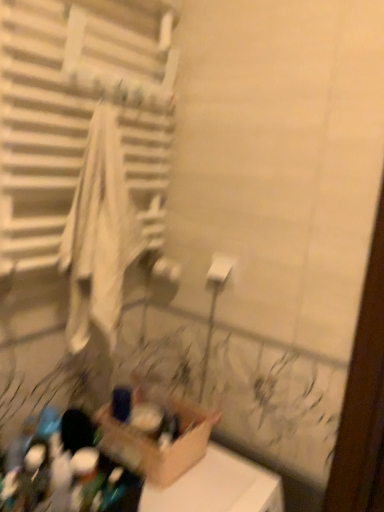
Describe the element at coordinates (154, 440) in the screenshot. I see `cardboard box at lower center` at that location.

What is the approximate width of white fabric towel at left?

white fabric towel at left is 6.79 inches wide.

This screenshot has height=512, width=384. Describe the element at coordinates (99, 236) in the screenshot. I see `white fabric towel at left` at that location.

What is the approximate width of white matte toilet paper at center?

1.85 inches.

Where is `cardboard box at lower center`? cardboard box at lower center is located at coordinates (154, 440).

Locate an element on the screen. bath towel above the cardboard box at lower center (from a real-world perspective) is located at coordinates (99, 236).

Which point is more distant from viewer, (x=185, y=449) or (x=85, y=297)?

The point (x=185, y=449) is more distant.

Is cardboard box at lower center positioned with its back to white fabric towel at left?

No, cardboard box at lower center's orientation is not away from white fabric towel at left.

Is cardboard box at lower center with white fabric towel at left?

No, cardboard box at lower center is not beside white fabric towel at left.

Find the location of `cardboard box located below the white matte toilet paper at center (from the image's perspective)`. cardboard box located below the white matte toilet paper at center (from the image's perspective) is located at coordinates (154, 440).

How far apart are white matte toilet paper at center and cardboard box at lower center?

A distance of 16.97 inches exists between white matte toilet paper at center and cardboard box at lower center.

In the image, is white matte toilet paper at center positioned in front of or behind cardboard box at lower center?

Clearly, white matte toilet paper at center is behind cardboard box at lower center.

From the picture: Considering the relative sizes of white matte toilet paper at center and cardboard box at lower center in the image provided, is white matte toilet paper at center taller than cardboard box at lower center?

No.

Is white matte toilet paper at center oriented towards white fabric towel at left?

Yes, white matte toilet paper at center is turned towards white fabric towel at left.

From the picture: Is white matte toilet paper at center bigger than white fabric towel at left?

Actually, white matte toilet paper at center might be smaller than white fabric towel at left.

Based on the photo, from the image's perspective, is white matte toilet paper at center on top of white fabric towel at left?

Actually, white matte toilet paper at center appears below white fabric towel at left in the image.

How distant is white matte toilet paper at center from white fabric towel at left?

white matte toilet paper at center is 34.87 centimeters from white fabric towel at left.

Considering the sizes of objects white fabric towel at left and white matte toilet paper at center in the image provided, who is smaller, white fabric towel at left or white matte toilet paper at center?

With smaller size is white matte toilet paper at center.

Considering the relative positions of white fabric towel at left and white matte toilet paper at center in the image provided, is white fabric towel at left in front of white matte toilet paper at center?

Yes, the depth of white fabric towel at left is less than that of white matte toilet paper at center.

The image size is (384, 512). Identify the location of bath towel above the white matte toilet paper at center (from the image's perspective). (99, 236).

Which is behind, white fabric towel at left or cardboard box at lower center?

cardboard box at lower center is further from the camera.

From a real-world perspective, is white fabric towel at left positioned above or below cardboard box at lower center?

Clearly, from a real-world perspective, white fabric towel at left is above cardboard box at lower center.

Is cardboard box at lower center completely or partially inside white fabric towel at left?

No.

Consider the image. From the image's perspective, is cardboard box at lower center below white matte toilet paper at center?

Indeed, from the image's perspective, cardboard box at lower center is shown beneath white matte toilet paper at center.

Is cardboard box at lower center touching white matte toilet paper at center?

No, cardboard box at lower center is not in contact with white matte toilet paper at center.

Considering the relative sizes of cardboard box at lower center and white matte toilet paper at center in the image provided, is cardboard box at lower center smaller than white matte toilet paper at center?

No.

Where is `bath towel that appears above the cardboard box at lower center (from the image's perspective)`? This screenshot has height=512, width=384. bath towel that appears above the cardboard box at lower center (from the image's perspective) is located at coordinates (99, 236).

Identify the location of toilet paper on the right of cardboard box at lower center. 220,268.

Looking at the image, which one is located further to white matte toilet paper at center, cardboard box at lower center or white fabric towel at left?

Among the two, cardboard box at lower center is located further to white matte toilet paper at center.

When comparing their distances from cardboard box at lower center, does white matte toilet paper at center or white fabric towel at left seem further?

white matte toilet paper at center is further to cardboard box at lower center.

From the image, which object appears to be nearer to white fabric towel at left, cardboard box at lower center or white matte toilet paper at center?

The object closer to white fabric towel at left is white matte toilet paper at center.

Considering their positions, is white fabric towel at left positioned further to white matte toilet paper at center than cardboard box at lower center?

cardboard box at lower center is further to white matte toilet paper at center.

Based on their spatial positions, is white fabric towel at left or white matte toilet paper at center closer to cardboard box at lower center?

white fabric towel at left lies closer to cardboard box at lower center than the other object.

Based on the photo, estimate the real-world distances between objects in this image. Which object is further from white fabric towel at left, white matte toilet paper at center or cardboard box at lower center?

cardboard box at lower center is further to white fabric towel at left.

You are a GUI agent. You are given a task and a screenshot of the screen. Output one action in this format:
    pyautogui.click(x=<x>, y=<y>)
    Task: Click on the toilet paper between white fabric towel at left and cardboard box at lower center from top to bottom
    The width and height of the screenshot is (384, 512).
    Given the screenshot: What is the action you would take?
    pyautogui.click(x=220, y=268)